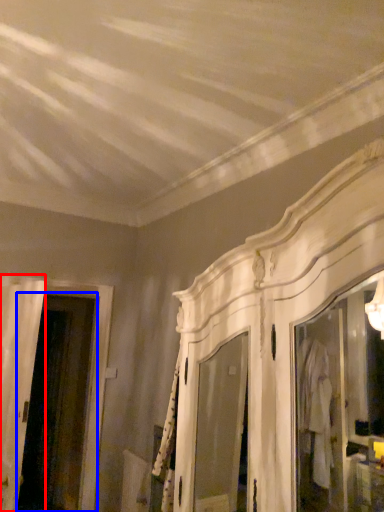
Question: Which point is further to the camera, door (highlighted by a red box) or screen door (highlighted by a blue box)?

Choices:
 (A) door
 (B) screen door

Answer: (B)